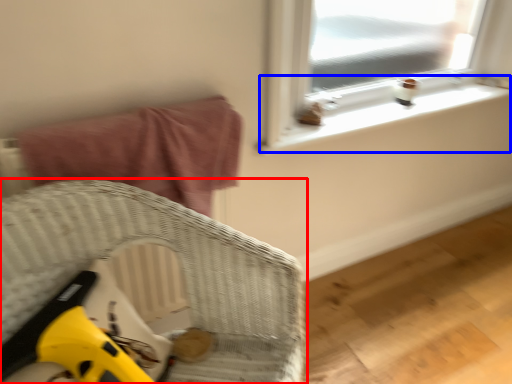
Question: Which object appears closest to the camera in this image, furniture (highlighted by a red box) or window sill (highlighted by a blue box)?

Choices:
 (A) furniture
 (B) window sill

Answer: (A)